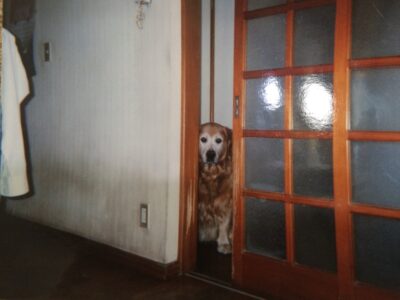
Find the location of a particular element. The width and height of the screenshot is (400, 300). plug outlet is located at coordinates (143, 217).